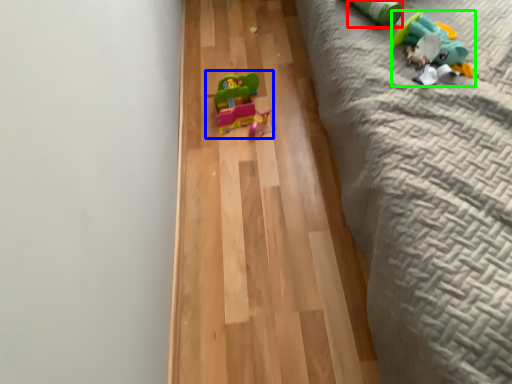
Question: Which object is the farthest from toy (highlighted by a red box)? Choose among these: toy (highlighted by a blue box) or toy (highlighted by a green box).

Choices:
 (A) toy
 (B) toy

Answer: (A)